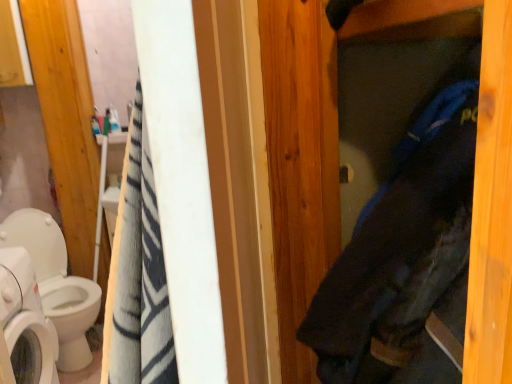
Question: Is dark blue fabric at center to the right of white glossy toilet at left from the viewer's perspective?

Choices:
 (A) no
 (B) yes

Answer: (B)

Question: Could you tell me if dark blue fabric at center is facing white glossy toilet at left?

Choices:
 (A) no
 (B) yes

Answer: (A)

Question: Is dark blue fabric at center positioned with its back to white glossy toilet at left?

Choices:
 (A) yes
 (B) no

Answer: (B)

Question: Is dark blue fabric at center wider than white glossy toilet at left?

Choices:
 (A) yes
 (B) no

Answer: (B)

Question: Can you confirm if dark blue fabric at center is positioned to the left of white glossy toilet at left?

Choices:
 (A) yes
 (B) no

Answer: (B)

Question: From the image's perspective, would you say dark blue fabric at center is shown under white glossy toilet at left?

Choices:
 (A) yes
 (B) no

Answer: (B)

Question: From a real-world perspective, is dark blue fabric at center beneath white glossy washing machine at lower left?

Choices:
 (A) yes
 (B) no

Answer: (B)

Question: Can you see dark blue fabric at center touching white glossy washing machine at lower left?

Choices:
 (A) no
 (B) yes

Answer: (A)

Question: Would you say dark blue fabric at center is a long distance from white glossy washing machine at lower left?

Choices:
 (A) yes
 (B) no

Answer: (A)

Question: Can you confirm if dark blue fabric at center is wider than white glossy washing machine at lower left?

Choices:
 (A) yes
 (B) no

Answer: (A)

Question: Does dark blue fabric at center have a larger size compared to white glossy washing machine at lower left?

Choices:
 (A) no
 (B) yes

Answer: (B)

Question: Is dark blue fabric at center positioned with its back to white glossy washing machine at lower left?

Choices:
 (A) yes
 (B) no

Answer: (B)

Question: Is white glossy washing machine at lower left with white glossy toilet at left?

Choices:
 (A) no
 (B) yes

Answer: (A)